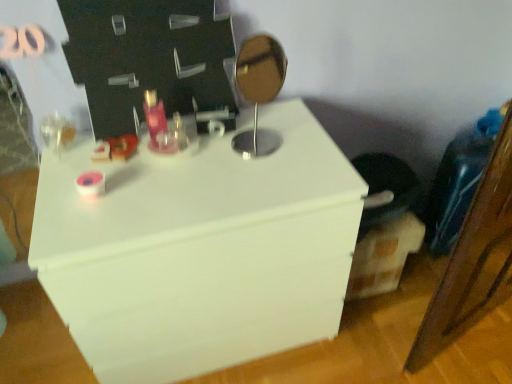
In order to click on free space to the left of matte pink glass at center in this screenshot , I will do `click(83, 161)`.